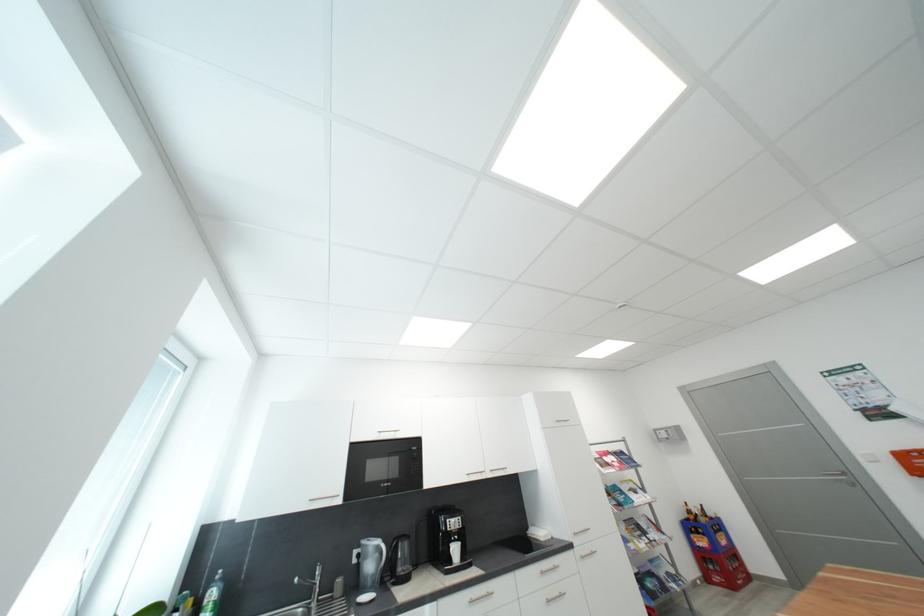
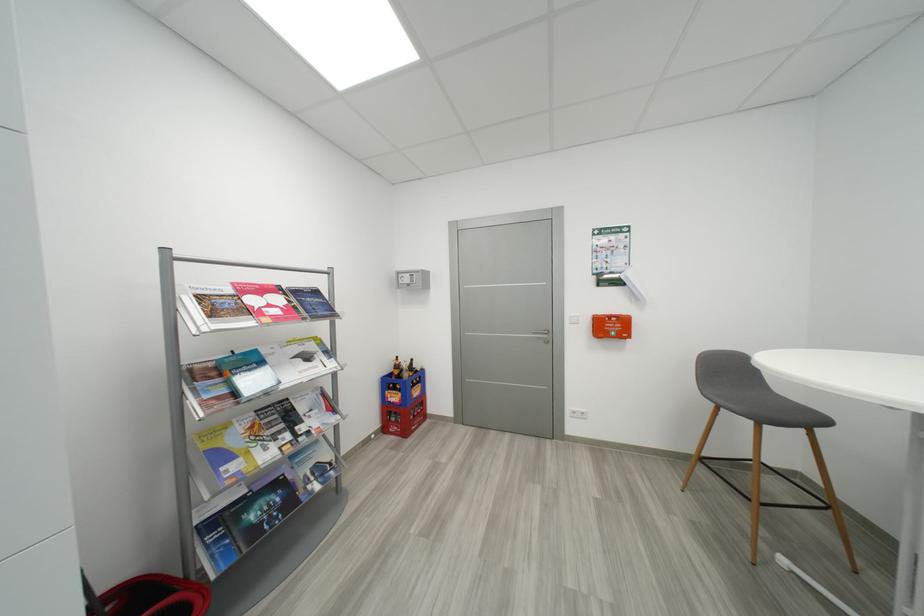
Where in the second image is the point corresponding to point (641, 493) from the first image?

(314, 359)